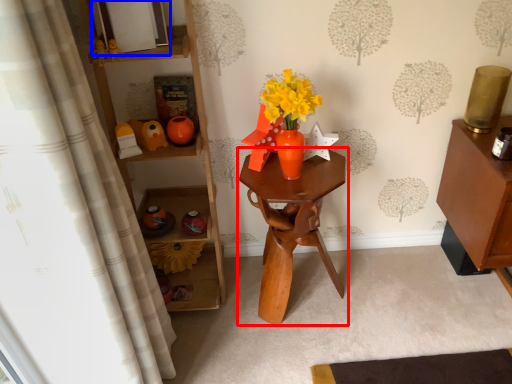
Question: Which of the following is the closest to the observer, table (highlighted by a red box) or picture frame (highlighted by a blue box)?

Choices:
 (A) table
 (B) picture frame

Answer: (B)